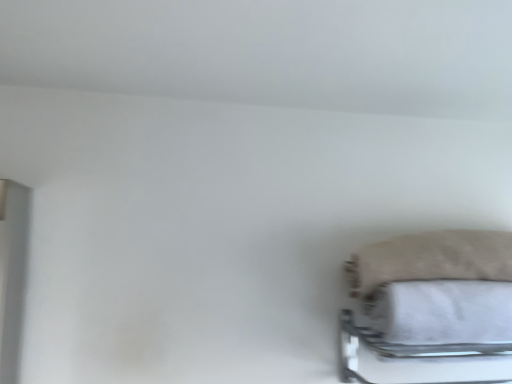
Where is `beige fuzzy pillow at lower right`? The image size is (512, 384). beige fuzzy pillow at lower right is located at coordinates (431, 259).

What do you see at coordinates (442, 312) in the screenshot?
I see `white fabric bath towel at lower right` at bounding box center [442, 312].

Locate an element on the screen. The image size is (512, 384). metallic silver bed frame at lower right is located at coordinates (418, 359).

What do you see at coordinates (418, 359) in the screenshot?
I see `metallic silver bed frame at lower right` at bounding box center [418, 359].

At what (x,y) coordinates should I click in order to perform the action: click on beige fuzzy pillow at lower right. Please return your answer as a coordinate pair (x, y). Looking at the image, I should click on (431, 259).

From a real-world perspective, who is located higher, metallic silver bed frame at lower right or beige fuzzy pillow at lower right?

beige fuzzy pillow at lower right, from a real-world perspective.

Considering their positions, is metallic silver bed frame at lower right located in front of or behind beige fuzzy pillow at lower right?

Visually, metallic silver bed frame at lower right is located in front of beige fuzzy pillow at lower right.

Looking at this image, is metallic silver bed frame at lower right at the left side of beige fuzzy pillow at lower right?

Indeed, metallic silver bed frame at lower right is positioned on the left side of beige fuzzy pillow at lower right.

Considering the sizes of objects beige fuzzy pillow at lower right and metallic silver bed frame at lower right in the image provided, who is smaller, beige fuzzy pillow at lower right or metallic silver bed frame at lower right?

Smaller between the two is beige fuzzy pillow at lower right.

Does point (483, 265) come closer to viewer compared to point (493, 367)?

That is True.

From a real-world perspective, which object stands above the other?

beige fuzzy pillow at lower right, from a real-world perspective.

Is beige fuzzy pillow at lower right positioned with its back to metallic silver bed frame at lower right?

No, beige fuzzy pillow at lower right's orientation is not away from metallic silver bed frame at lower right.

Is white fabric bath towel at lower right taller than metallic silver bed frame at lower right?

No.

In terms of size, does white fabric bath towel at lower right appear bigger or smaller than metallic silver bed frame at lower right?

white fabric bath towel at lower right is smaller than metallic silver bed frame at lower right.

Which point is more forward, (453,292) or (373,363)?

The point (453,292) is more forward.

The image size is (512, 384). Find the location of `bath towel that is behind the metallic silver bed frame at lower right`. bath towel that is behind the metallic silver bed frame at lower right is located at coordinates (442, 312).

Can you see metallic silver bed frame at lower right touching white fabric bath towel at lower right?

No, metallic silver bed frame at lower right is not beside white fabric bath towel at lower right.

Looking at this image, can you confirm if metallic silver bed frame at lower right is thinner than white fabric bath towel at lower right?

No.

How distant is metallic silver bed frame at lower right from white fabric bath towel at lower right?

metallic silver bed frame at lower right is 4.73 inches away from white fabric bath towel at lower right.

Which object is positioned more to the left, metallic silver bed frame at lower right or white fabric bath towel at lower right?

metallic silver bed frame at lower right.

From a real-world perspective, which is physically below, white fabric bath towel at lower right or beige fuzzy pillow at lower right?

white fabric bath towel at lower right is physically lower.

Is white fabric bath towel at lower right at the left side of beige fuzzy pillow at lower right?

Incorrect, white fabric bath towel at lower right is not on the left side of beige fuzzy pillow at lower right.

Is white fabric bath towel at lower right taller than beige fuzzy pillow at lower right?

Correct, white fabric bath towel at lower right is much taller as beige fuzzy pillow at lower right.

Is white fabric bath towel at lower right surrounding beige fuzzy pillow at lower right?

No.

Considering the relative sizes of beige fuzzy pillow at lower right and white fabric bath towel at lower right in the image provided, is beige fuzzy pillow at lower right thinner than white fabric bath towel at lower right?

Incorrect, the width of beige fuzzy pillow at lower right is not less than that of white fabric bath towel at lower right.

From a real-world perspective, is beige fuzzy pillow at lower right physically located above or below white fabric bath towel at lower right?

From a real-world perspective, beige fuzzy pillow at lower right is physically above white fabric bath towel at lower right.

From the image's perspective, would you say beige fuzzy pillow at lower right is shown under white fabric bath towel at lower right?

No.

Locate an element on the screen. bed frame below the beige fuzzy pillow at lower right (from the image's perspective) is located at coordinates (418, 359).

This screenshot has width=512, height=384. Identify the location of pillow to the right of metallic silver bed frame at lower right. (431, 259).

Which object lies nearer to the anchor point beige fuzzy pillow at lower right, white fabric bath towel at lower right or metallic silver bed frame at lower right?

white fabric bath towel at lower right.

When comparing their distances from beige fuzzy pillow at lower right, does metallic silver bed frame at lower right or white fabric bath towel at lower right seem further?

Based on the image, metallic silver bed frame at lower right appears to be further to beige fuzzy pillow at lower right.

Estimate the real-world distances between objects in this image. Which object is further from white fabric bath towel at lower right, metallic silver bed frame at lower right or beige fuzzy pillow at lower right?

Among the two, metallic silver bed frame at lower right is located further to white fabric bath towel at lower right.

When comparing their distances from metallic silver bed frame at lower right, does beige fuzzy pillow at lower right or white fabric bath towel at lower right seem closer?

white fabric bath towel at lower right.

Which object lies nearer to the anchor point white fabric bath towel at lower right, beige fuzzy pillow at lower right or metallic silver bed frame at lower right?

beige fuzzy pillow at lower right lies closer to white fabric bath towel at lower right than the other object.

Based on their spatial positions, is white fabric bath towel at lower right or beige fuzzy pillow at lower right closer to metallic silver bed frame at lower right?

white fabric bath towel at lower right.

Locate an element on the screen. The image size is (512, 384). bath towel between beige fuzzy pillow at lower right and metallic silver bed frame at lower right in the up-down direction is located at coordinates (442, 312).